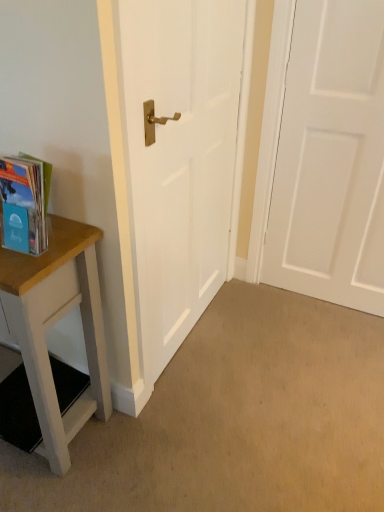
At what (x,y) coordinates should I click in order to perform the action: click on free spot to the right of translucent plastic book at left. Please return your answer as a coordinate pair (x, y). The image size is (384, 512). Looking at the image, I should click on (70, 242).